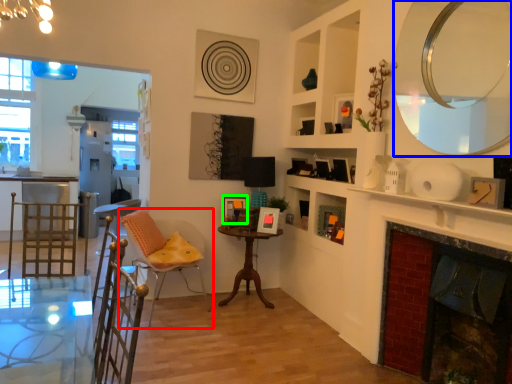
Question: Estimate the real-world distances between objects in this image. Which object is farther from chair (highlighted by a red box), mirror (highlighted by a blue box) or picture frame (highlighted by a green box)?

Choices:
 (A) mirror
 (B) picture frame

Answer: (A)